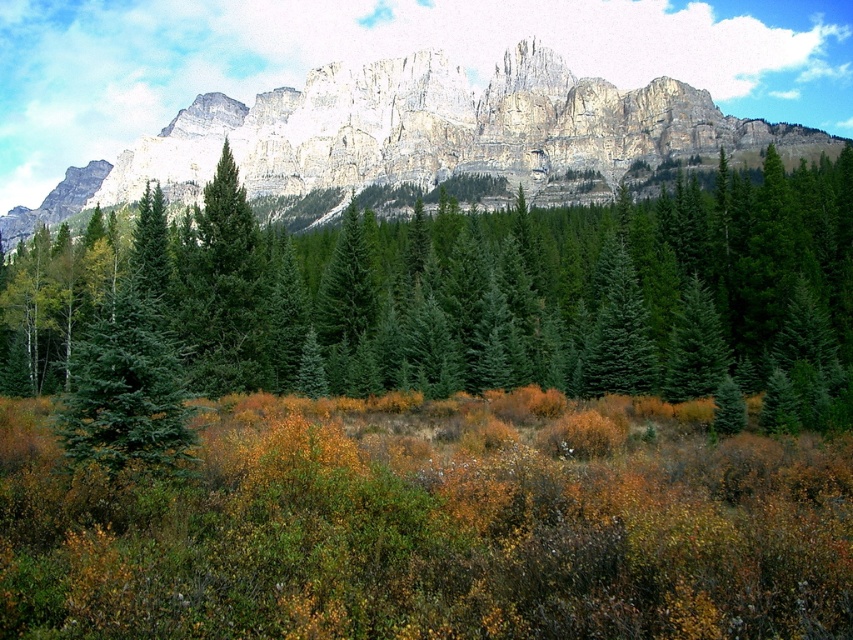
The height and width of the screenshot is (640, 853). What do you see at coordinates (524, 291) in the screenshot?
I see `green matte evergreen tree at center` at bounding box center [524, 291].

Does green matte evergreen tree at center have a greater height compared to rugged stone mountain at upper center?

No.

Which is in front, point (757, 259) or point (207, 141)?

Point (757, 259) is more forward.

What are the coordinates of `green matte evergreen tree at center` in the screenshot? It's located at (524, 291).

Measure the distance between rugged stone mountain at upper center and green matte evergreen tree at left.

220.50 meters

Is point (531, 145) closer to viewer compared to point (94, 356)?

No, it is not.

Between point (662, 77) and point (129, 355), which one is positioned behind?

Positioned behind is point (662, 77).

Find the location of a particular element. The image size is (853, 640). rugged stone mountain at upper center is located at coordinates 421,132.

Between green matte evergreen tree at center and green matte evergreen tree at left, which one has more height?

green matte evergreen tree at center is taller.

From the picture: Is green matte evergreen tree at center in front of green matte evergreen tree at left?

No, green matte evergreen tree at center is behind green matte evergreen tree at left.

Where is `green matte evergreen tree at center`? Image resolution: width=853 pixels, height=640 pixels. green matte evergreen tree at center is located at coordinates (524, 291).